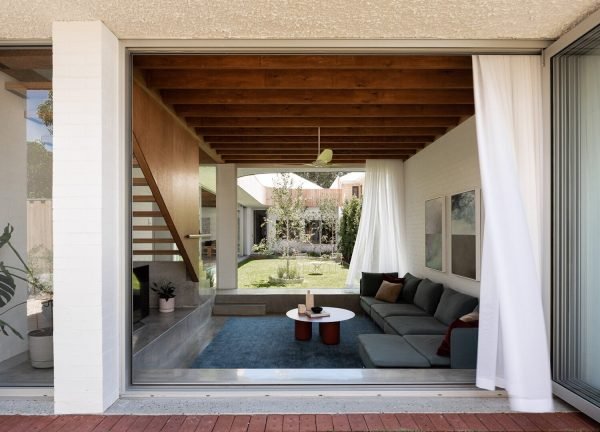
Where is `round coffee table`? round coffee table is located at coordinates (333, 315).